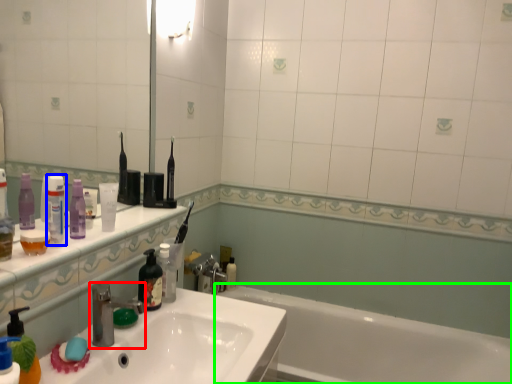
Question: Considering the real-world distances, which object is closest to tap (highlighted by a red box)? toiletry (highlighted by a blue box) or bathtub (highlighted by a green box).

Choices:
 (A) toiletry
 (B) bathtub

Answer: (A)